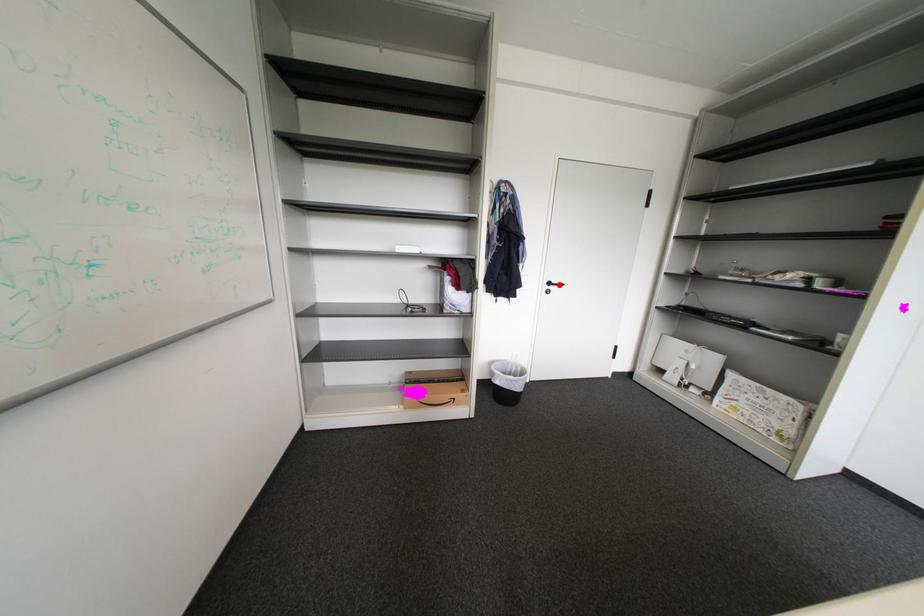
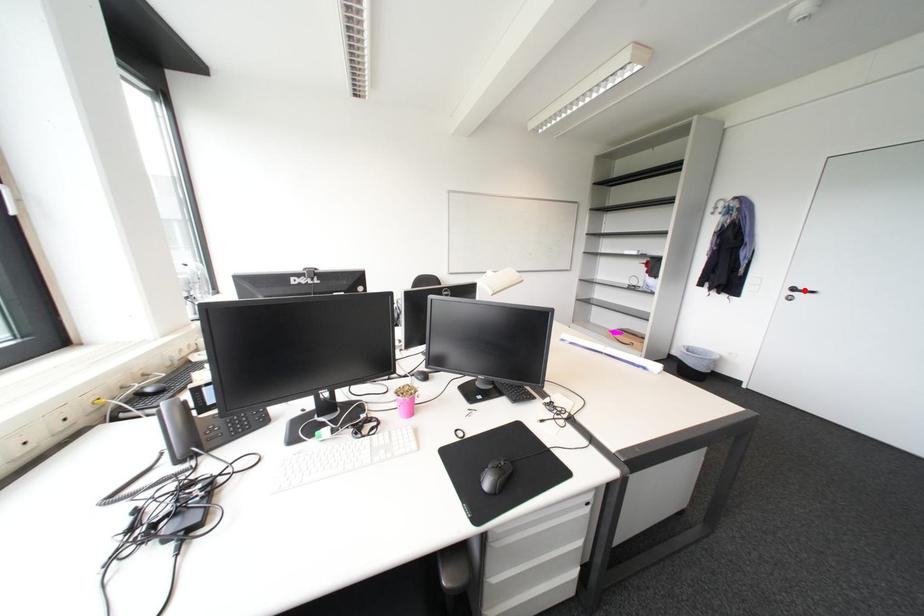
I am providing you with two images of the same scene from different viewpoints. A red point is marked on the first image and another point is marked on the second image. Does the point marked in image1 correspond to the same location as the one in image2?

Yes